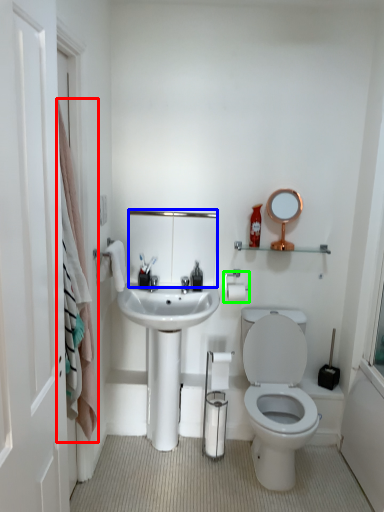
Question: Which is farther away from shower curtain (highlighted by a red box)? mirror (highlighted by a blue box) or towel bar (highlighted by a green box)?

Choices:
 (A) mirror
 (B) towel bar

Answer: (B)